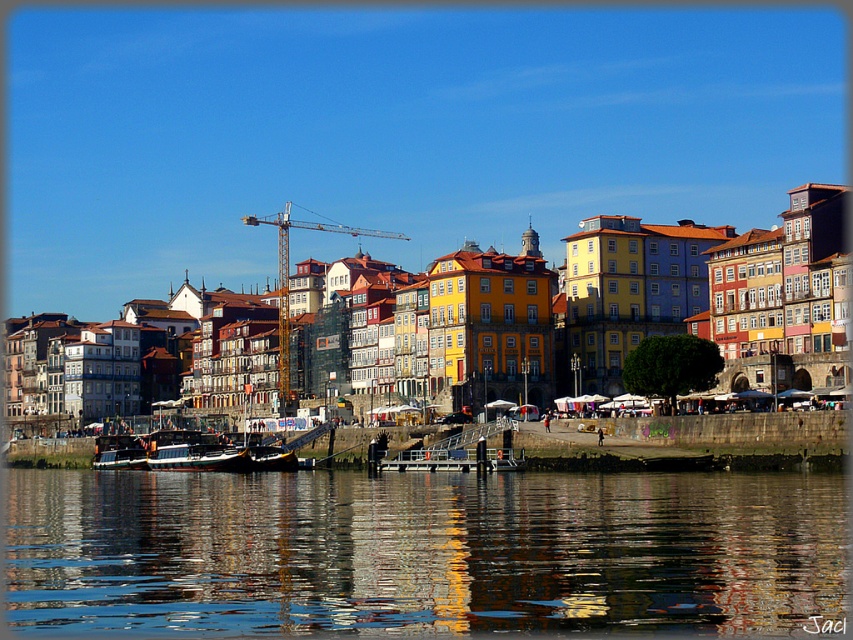
Does reflective glass water at lower center have a lesser height compared to wooden boat at left?

In fact, reflective glass water at lower center may be taller than wooden boat at left.

Which is below, reflective glass water at lower center or wooden boat at left?

wooden boat at left is below.

Between point (560, 512) and point (109, 458), which one is positioned behind?

Point (109, 458)

Locate an element on the screen. Image resolution: width=853 pixels, height=640 pixels. reflective glass water at lower center is located at coordinates (422, 552).